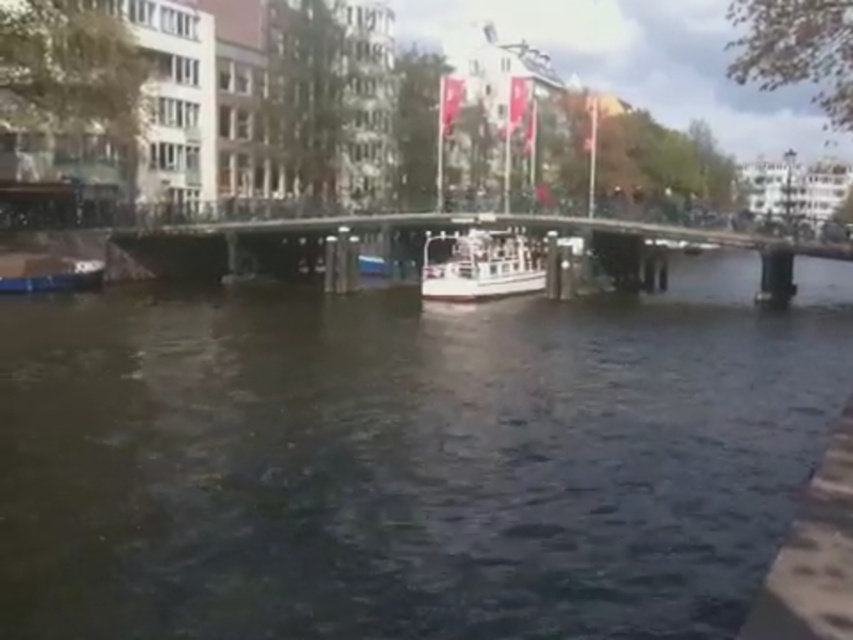
Question: Which point is closer to the camera taking this photo?

Choices:
 (A) (694, 586)
 (B) (444, 260)
 (C) (785, 276)

Answer: (A)

Question: Which point appears farthest from the camera in this image?

Choices:
 (A) (12, 276)
 (B) (448, 257)

Answer: (B)

Question: Does dark water at center appear over metallic silver boat at left?

Choices:
 (A) yes
 (B) no

Answer: (B)

Question: In this image, where is white painted steel bridge at center located relative to white glossy boat at center?

Choices:
 (A) above
 (B) below

Answer: (B)

Question: Does white painted steel bridge at center have a lesser width compared to white glossy boat at center?

Choices:
 (A) no
 (B) yes

Answer: (A)

Question: Which of the following is the farthest from the observer?

Choices:
 (A) (767, 312)
 (B) (471, 228)

Answer: (B)